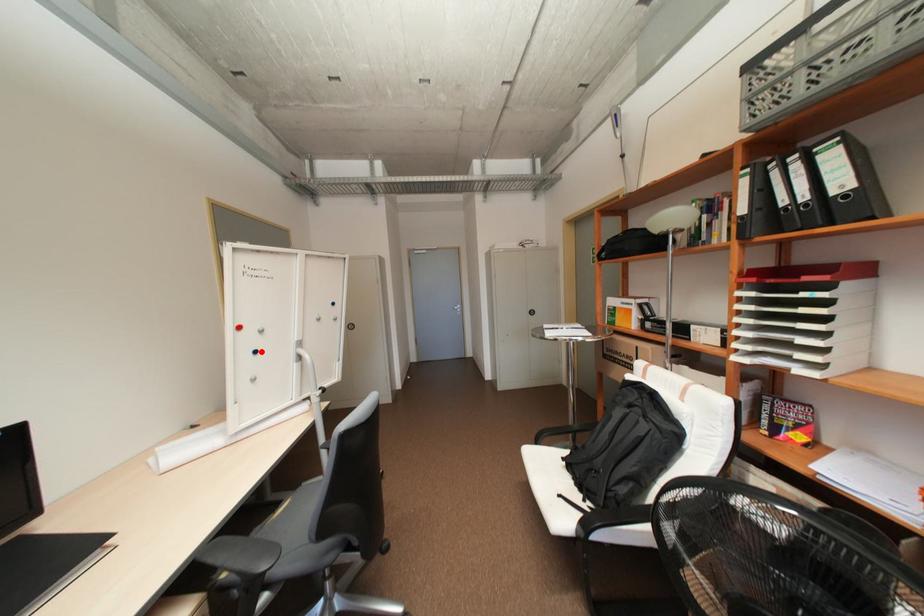
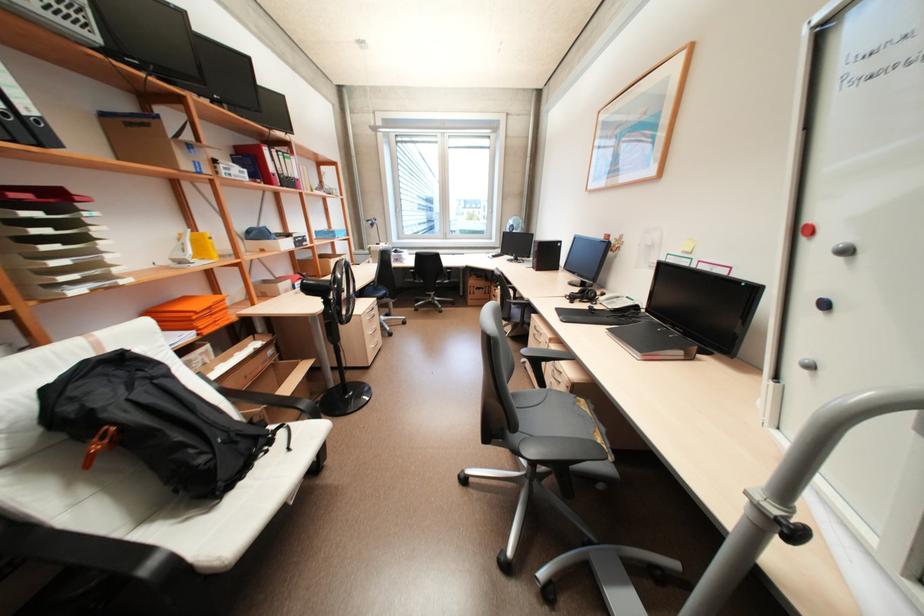
Where in the second image is the point corresponding to the highlighted location from the first image?

(830, 304)